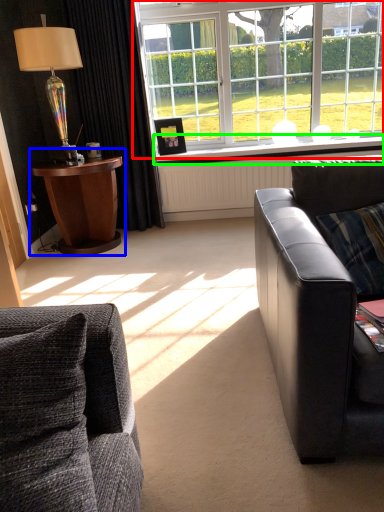
Question: Estimate the real-world distances between objects in this image. Which object is closer to window (highlighted by a red box), table (highlighted by a blue box) or window sill (highlighted by a green box)?

Choices:
 (A) table
 (B) window sill

Answer: (A)